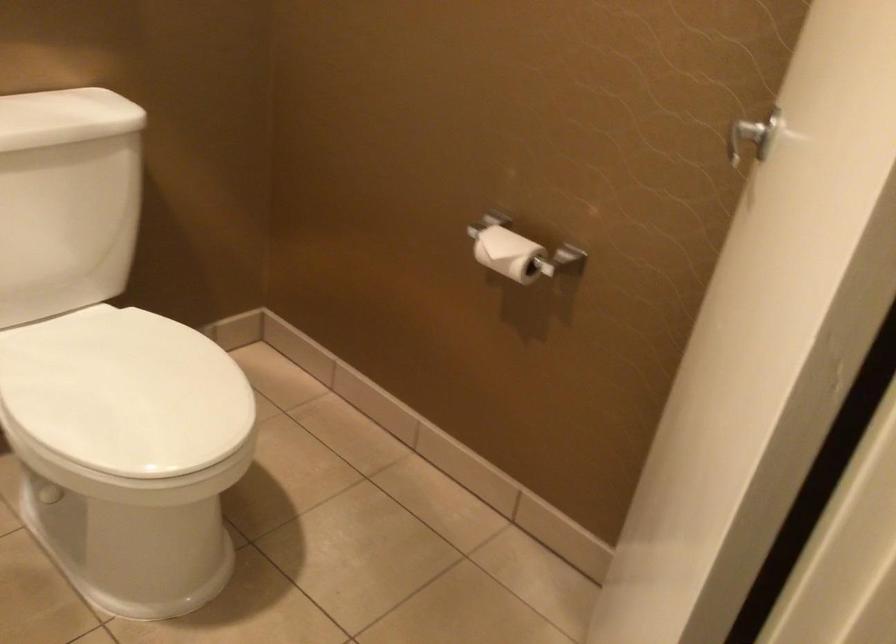
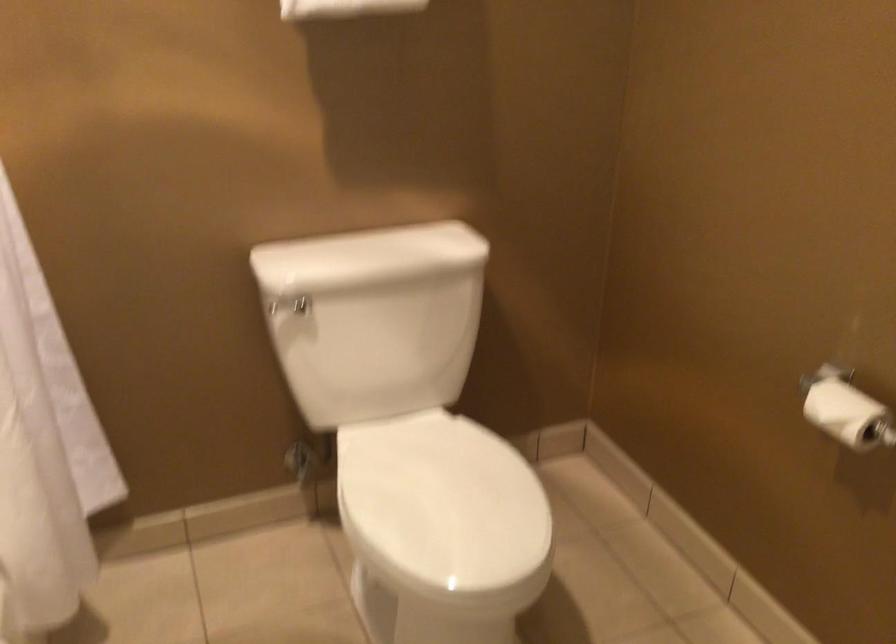
Where in the second image is the point corresponding to point (132, 391) from the first image?

(442, 505)